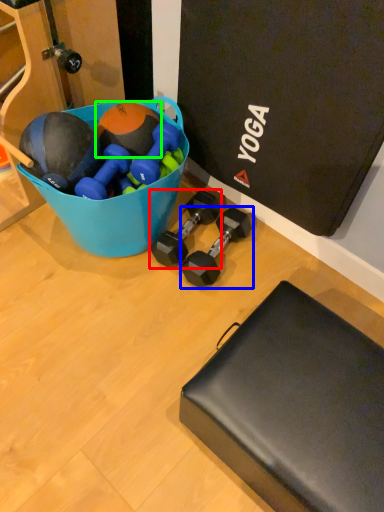
Question: Which object is positioned farthest from dumbbell (highlighted by a red box)? Select from dumbbell (highlighted by a blue box) and sports equipment (highlighted by a green box).

Choices:
 (A) dumbbell
 (B) sports equipment

Answer: (B)